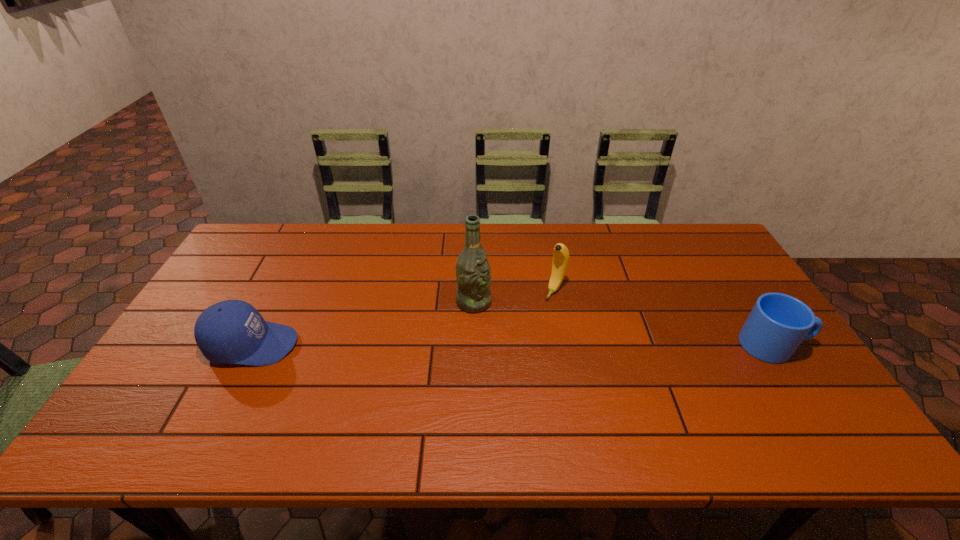
Find the location of `cap`. cap is located at coordinates (232, 331).

Locate an element on the screen. the rightmost object is located at coordinates (778, 323).

Where is `banana`? The height and width of the screenshot is (540, 960). banana is located at coordinates (560, 262).

This screenshot has width=960, height=540. Find the location of `the third object from left to right`. the third object from left to right is located at coordinates (560, 262).

The image size is (960, 540). Find the location of `beer bottle`. beer bottle is located at coordinates (473, 274).

The image size is (960, 540). Identify the location of the tallest object. click(473, 274).

Find the location of `free space located 0.090m on the front-facing side of the leftmost object`. free space located 0.090m on the front-facing side of the leftmost object is located at coordinates (330, 345).

Image resolution: width=960 pixels, height=540 pixels. I want to click on vacant region located 0.150m from the stem of the banana, so click(528, 331).

Where is `free space located 0.370m from the stem of the banana`? free space located 0.370m from the stem of the banana is located at coordinates (487, 387).

What are the coordinates of `free space located 0.080m from the stem of the banana` in the screenshot? It's located at 539,316.